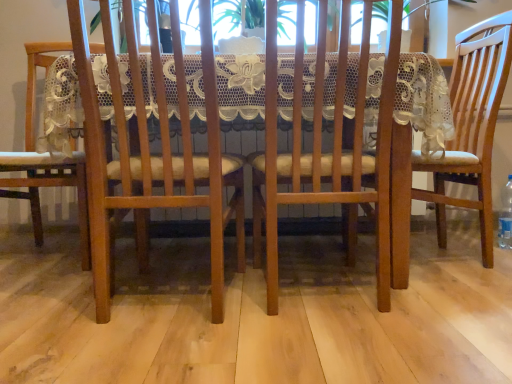
Question: From a real-world perspective, is wooden chair at center, which ranks as the second chair in right-to-left order, physically located above or below wooden table at center?

Choices:
 (A) above
 (B) below

Answer: (A)

Question: Considering the positions of wooden chair at center, which ranks as the second chair in right-to-left order, and wooden table at center in the image, is wooden chair at center, which ranks as the second chair in right-to-left order, bigger or smaller than wooden table at center?

Choices:
 (A) small
 (B) big

Answer: (A)

Question: Which is nearer to the matte wood chair at right, which appears as the 4th chair when viewed from the left?

Choices:
 (A) wooden chair at center, marked as the third chair in a left-to-right arrangement
 (B) clear plastic bottle at lower right
 (C) matte wood chair at left, the fourth chair viewed from the right
 (D) wooden chair at center, placed as the second chair when sorted from left to right
 (E) wooden table at center

Answer: (A)

Question: Based on their relative distances, which object is farther from the clear plastic bottle at lower right?

Choices:
 (A) wooden chair at center, which ranks as the second chair in right-to-left order
 (B) matte wood chair at left, the fourth chair viewed from the right
 (C) wooden chair at center, placed as the second chair when sorted from left to right
 (D) matte wood chair at right, which appears as the 4th chair when viewed from the left
 (E) wooden table at center

Answer: (B)